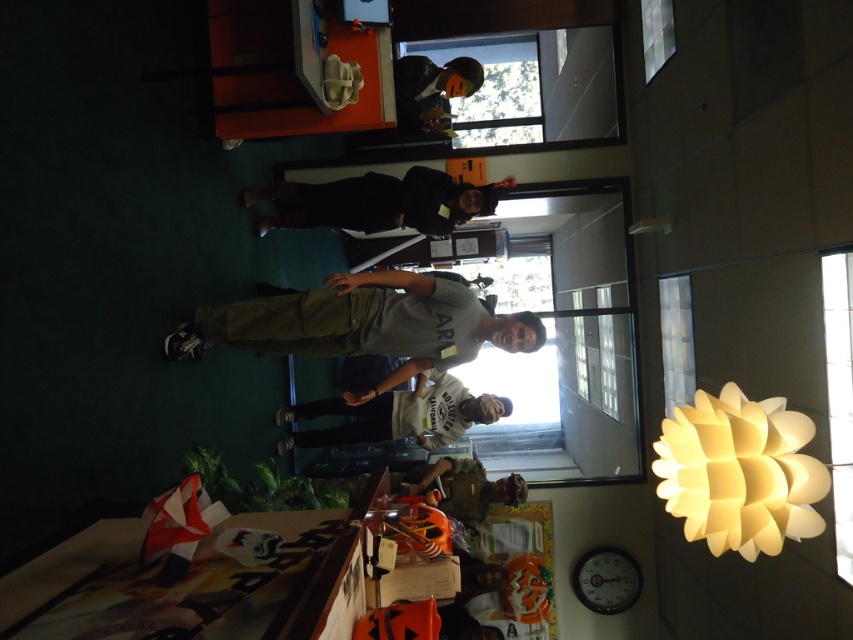
You are a delivery person who needs to place a package between the matte black jacket at upper center and the camouflage fabric backpack at center. The package is 3 meters long. Can you fit it between them?

The distance between the matte black jacket at upper center and the camouflage fabric backpack at center is 2.56 meters, so the 3 meter package is too long to fit between them.

You are standing in the rotated image and want to reach the door outside. To do so, you must pass between the matte black jacket at upper center and the camouflage fabric backpack at center. Which direction should you move relative to the jacket to avoid the backpack?

Since the matte black jacket at upper center is to the left of the camouflage fabric backpack at center, you should move to the right of the jacket to avoid the backpack and head towards the door.

You are standing in the rotated image and want to move from the point at coordinates point [469,74] to the point at coordinates point [500,488]. Which direction should you face to walk towards the second point?

Since point [469,74] is closer to the viewer than point [500,488], you should face away from the viewer to walk towards the second point.